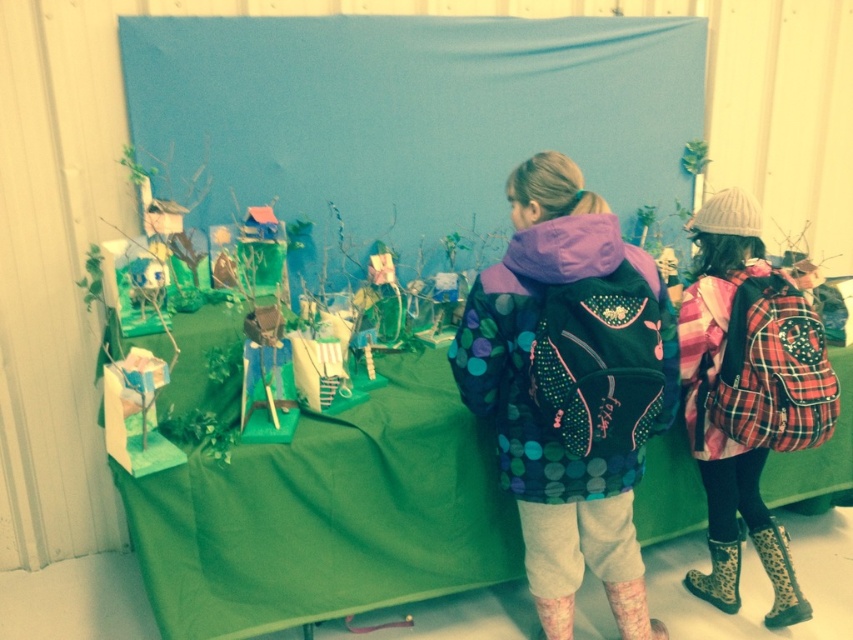
You are a tailor measuring the distance between two items for a display. You see the polka dot fabric jacket at center and the plaid fabric backpack at right. Can you fit a 40 cm wide decorative shelf between them?

The distance between the polka dot fabric jacket at center and the plaid fabric backpack at right is 44.41 centimeters, so yes, the 40 cm wide decorative shelf can fit between them since the space is wider than the shelf.

You are a fashion designer observing the leopard print fabric boot at lower right and the pink textured boot at lower right. Which boot is smaller in size?

The leopard print fabric boot at lower right has a smaller size compared to the pink textured boot at lower right.

You are organizing a shoe display and need to place the leopard print rubber boot at lower right and the pink textured boot at lower right on a shelf. Which boot should you place first if you want to ensure both fit side by side without overlapping?

Since the leopard print rubber boot at lower right is larger in size than the pink textured boot at lower right, you should place the larger leopard print rubber boot first to accommodate its size, then the smaller pink textured boot next to it.